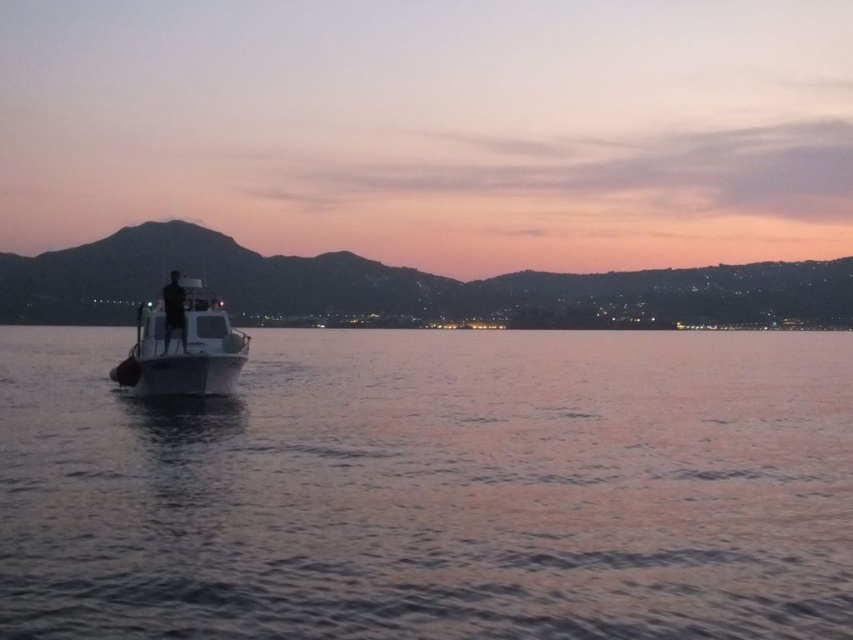
Question: Is smooth water at boat left behind white glossy boat at center?

Choices:
 (A) no
 (B) yes

Answer: (A)

Question: Which object is closer to the camera taking this photo?

Choices:
 (A) smooth water at boat left
 (B) white glossy boat at center

Answer: (A)

Question: Is smooth water at boat left behind white glossy boat at center?

Choices:
 (A) no
 (B) yes

Answer: (A)

Question: Which point appears farthest from the camera in this image?

Choices:
 (A) (169, 385)
 (B) (486, 540)

Answer: (A)

Question: Is smooth water at boat left positioned at the back of white glossy boat at center?

Choices:
 (A) yes
 (B) no

Answer: (B)